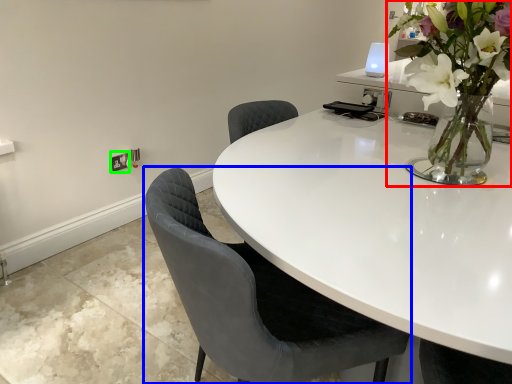
Question: Which object is the farthest from houseplant (highlighted by a red box)? Choose among these: chair (highlighted by a blue box) or electric outlet (highlighted by a green box).

Choices:
 (A) chair
 (B) electric outlet

Answer: (B)